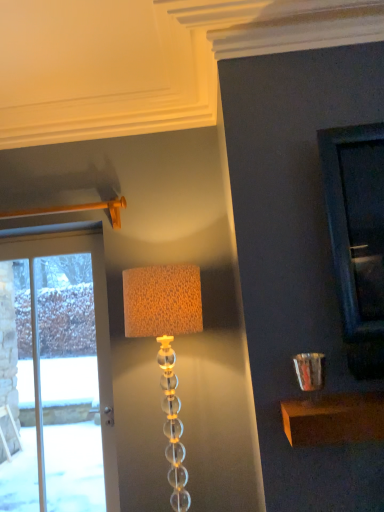
Question: From a real-world perspective, is translucent glass lamp at center positioned above or below white glass door at left?

Choices:
 (A) above
 (B) below

Answer: (B)

Question: Is translucent glass lamp at center to the left or to the right of white glass door at left in the image?

Choices:
 (A) left
 (B) right

Answer: (B)

Question: From the image's perspective, relative to white glass door at left, is translucent glass lamp at center above or below?

Choices:
 (A) above
 (B) below

Answer: (A)

Question: Would you say white glass door at left is to the left or to the right of translucent glass lamp at center in the picture?

Choices:
 (A) right
 (B) left

Answer: (B)

Question: Is white glass door at left spatially inside translucent glass lamp at center, or outside of it?

Choices:
 (A) inside
 (B) outside

Answer: (B)

Question: Based on their sizes in the image, would you say white glass door at left is bigger or smaller than translucent glass lamp at center?

Choices:
 (A) small
 (B) big

Answer: (A)

Question: Relative to translucent glass lamp at center, is white glass door at left in front or behind?

Choices:
 (A) behind
 (B) front

Answer: (A)